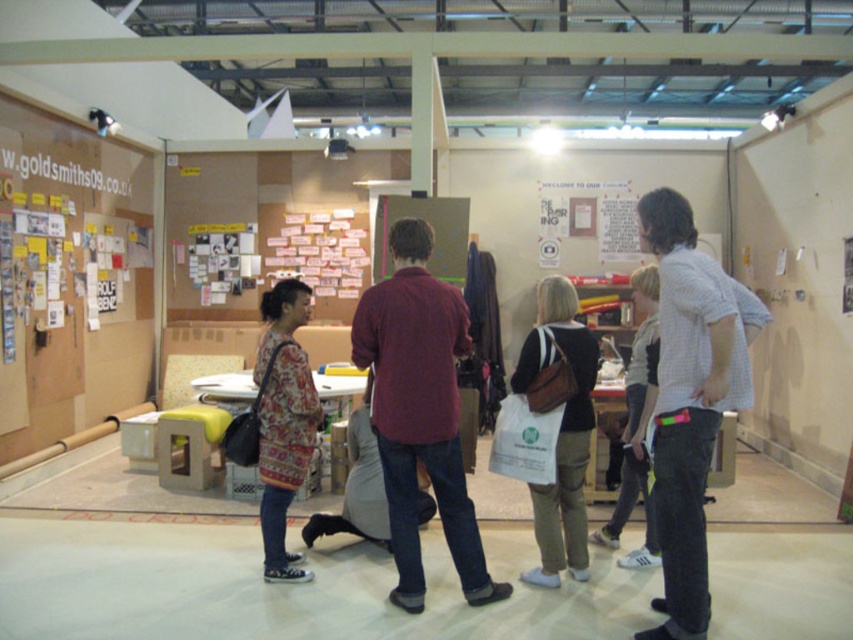
Question: Is checkered cotton shirt at right to the left of white canvas tote bag at center from the viewer's perspective?

Choices:
 (A) yes
 (B) no

Answer: (B)

Question: Which point is farther from the camera taking this photo?

Choices:
 (A) (558, 433)
 (B) (305, 413)

Answer: (B)

Question: Based on their relative distances, which object is farther from the white canvas tote bag at center?

Choices:
 (A) patterned fabric sweater at center
 (B) maroon shirt at center
 (C) checkered cotton shirt at right

Answer: (A)

Question: Which point is closer to the camera?

Choices:
 (A) (573, 332)
 (B) (467, 330)

Answer: (A)

Question: Does checkered cotton shirt at right appear on the left side of white canvas tote bag at center?

Choices:
 (A) yes
 (B) no

Answer: (B)

Question: Is maroon shirt at center bigger than white canvas tote bag at center?

Choices:
 (A) no
 (B) yes

Answer: (B)